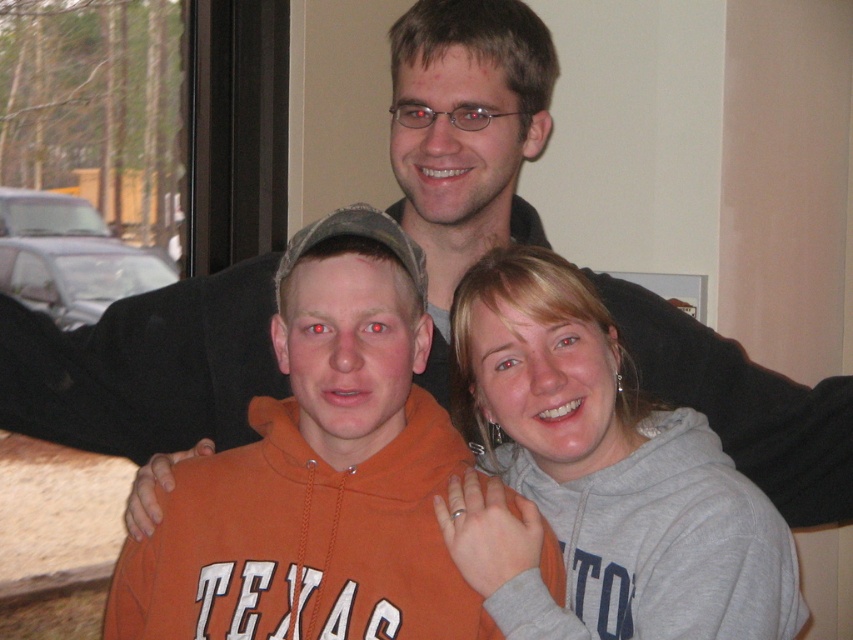
Who is more distant from viewer, (x=320, y=572) or (x=730, y=509)?

Positioned behind is point (x=730, y=509).

Where is `orange fleece sweatshirt at center`? orange fleece sweatshirt at center is located at coordinates (318, 474).